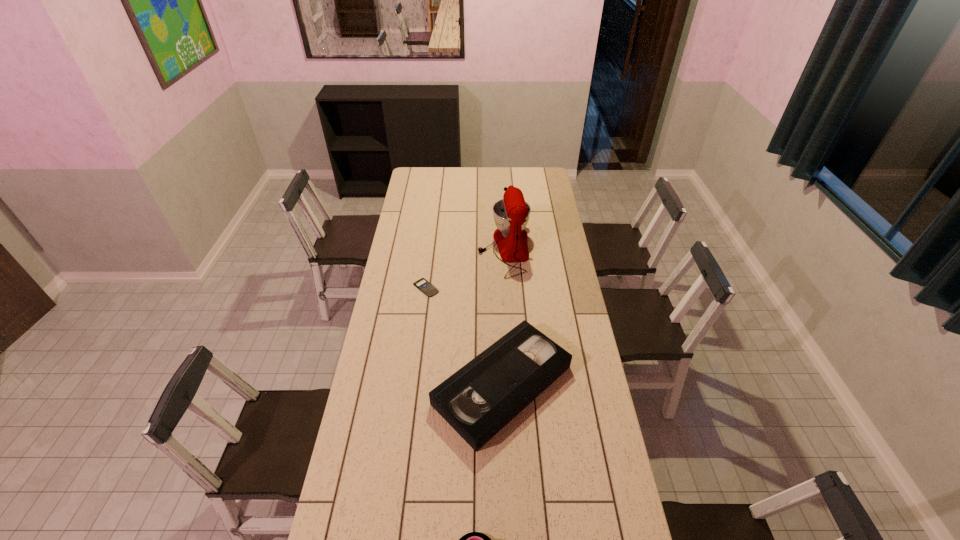
The image size is (960, 540). I want to click on the tallest object, so pyautogui.click(x=511, y=214).

You are a GUI agent. You are given a task and a screenshot of the screen. Output one action in this format:
    pyautogui.click(x=<x>, y=<y>)
    Task: Click on the videotape
    The height and width of the screenshot is (540, 960).
    Given the screenshot: What is the action you would take?
    pyautogui.click(x=482, y=397)

This screenshot has height=540, width=960. Find the location of `the leftmost object`. the leftmost object is located at coordinates (423, 285).

The width and height of the screenshot is (960, 540). Identify the location of the shortest object. (423, 285).

Find the location of `vacant space situated on the bowl side of the mixer`. vacant space situated on the bowl side of the mixer is located at coordinates (461, 249).

The image size is (960, 540). I want to click on vacant space situated on the bowl side of the mixer, so click(x=449, y=249).

Where is `vacant position located 0.130m on the bowl side of the mixer`? The image size is (960, 540). vacant position located 0.130m on the bowl side of the mixer is located at coordinates (453, 249).

This screenshot has width=960, height=540. I want to click on free location located 0.110m on the front of the third farthest object, so click(507, 485).

The width and height of the screenshot is (960, 540). In order to click on free location located on the front of the leftmost object in this screenshot , I will do `click(418, 356)`.

At what (x,y) coordinates should I click in order to perform the action: click on object present at the left edge. Please return your answer as a coordinate pair (x, y). The image size is (960, 540). Looking at the image, I should click on (423, 285).